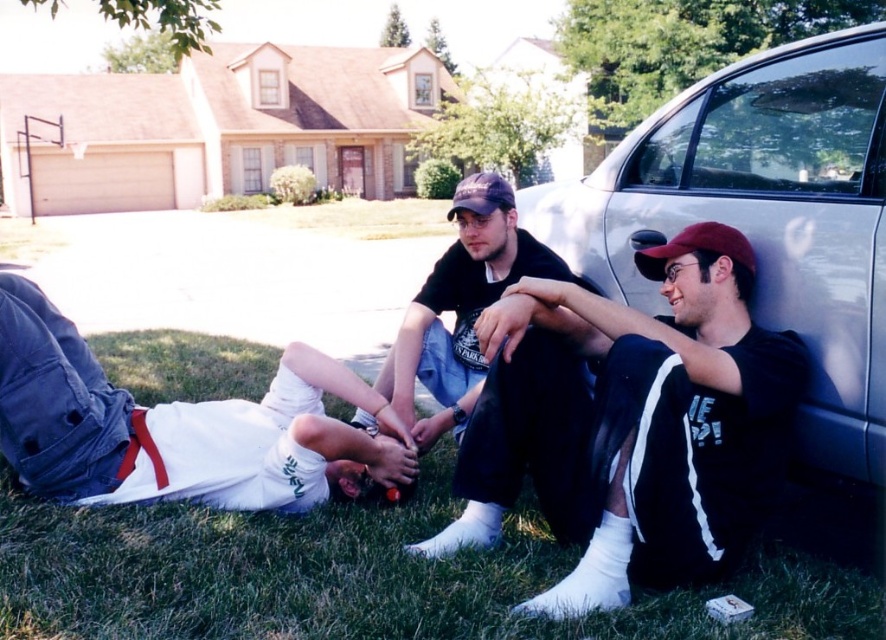
Question: Where is black matte shirt at center located in relation to black matte t-shirt at center in the image?

Choices:
 (A) left
 (B) right

Answer: (B)

Question: Among these objects, which one is farthest from the camera?

Choices:
 (A) black matte t-shirt at center
 (B) green grass at lower center

Answer: (A)

Question: Which object is the closest to the green grass at lower center?

Choices:
 (A) black matte shirt at center
 (B) silver metallic car at right
 (C) black matte t-shirt at center

Answer: (A)

Question: Does silver metallic car at right appear on the left side of black matte t-shirt at center?

Choices:
 (A) no
 (B) yes

Answer: (A)

Question: Is black matte shirt at center closer to the viewer compared to silver metallic car at right?

Choices:
 (A) no
 (B) yes

Answer: (B)

Question: Which point appears closest to the camera in this image?

Choices:
 (A) (259, 572)
 (B) (422, 364)
 (C) (773, 337)
 (D) (801, 230)

Answer: (C)